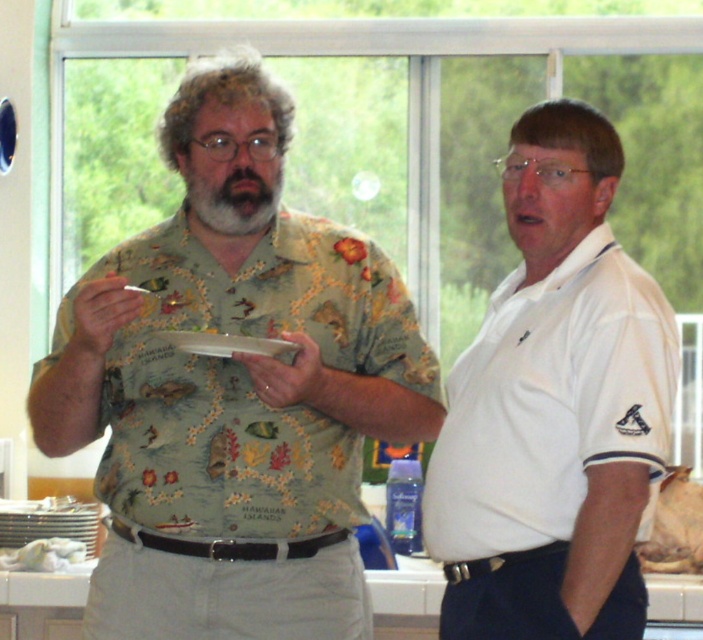
You are standing at point (264, 436) and want to move to the person on the right. The space between you and the person on the right is 2.60 meters. If you need to pass through a doorway that is 2.5 meters wide, will you be able to move through it without any issues?

The space between you and the person on the right is 2.60 meters. Since the doorway is 2.5 meters wide, which is narrower than the space between you and the person, you may not have enough room to pass through comfortably. It might be tight, so proceed with caution.

You are a guest at a garden party and notice the floral cotton shirt at center and the brown crumbly bread at right on the table. Can you tell me which item takes up more space visually?

The floral cotton shirt at center is larger in size than the brown crumbly bread at right, so it occupies more visual space.

You are a guest at a garden party and see the floral cotton shirt at center and the brown crumbly bread at right. Which object is higher up in the image?

The floral cotton shirt at center is taller than brown crumbly bread at right, so the floral cotton shirt at center is higher up in the image.